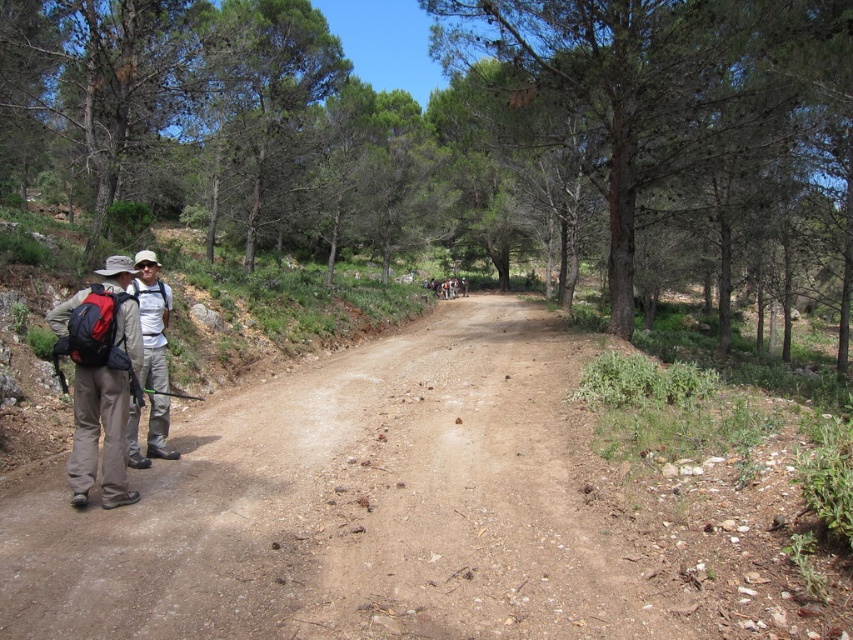
Does dirt road at left appear over green textured tree at center?

Actually, dirt road at left is below green textured tree at center.

Does dirt road at left have a greater height compared to green textured tree at center?

No, dirt road at left is not taller than green textured tree at center.

Identify the location of dirt road at left. (349, 508).

Does green textured tree at center have a greater height compared to matte khaki pants at left?

Yes.

Describe the element at coordinates (674, 109) in the screenshot. I see `green textured tree at center` at that location.

Which is in front, point (695, 109) or point (132, 419)?

Positioned in front is point (132, 419).

I want to click on green textured tree at center, so click(674, 109).

Is the position of matte black backpack at left more distant than that of matte khaki pants at left?

No, matte black backpack at left is closer to the viewer.

Locate an element on the screen. matte black backpack at left is located at coordinates (102, 378).